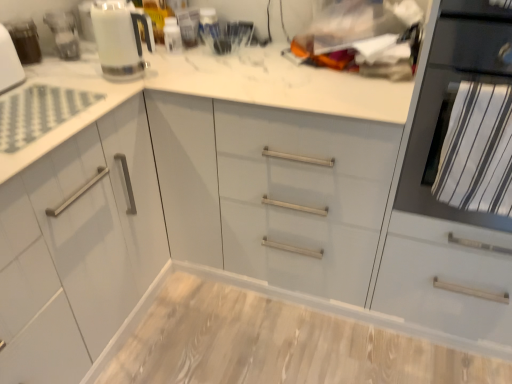
Locate an element on the screen. The height and width of the screenshot is (384, 512). free space in front of matte white kettle at upper left is located at coordinates (65, 64).